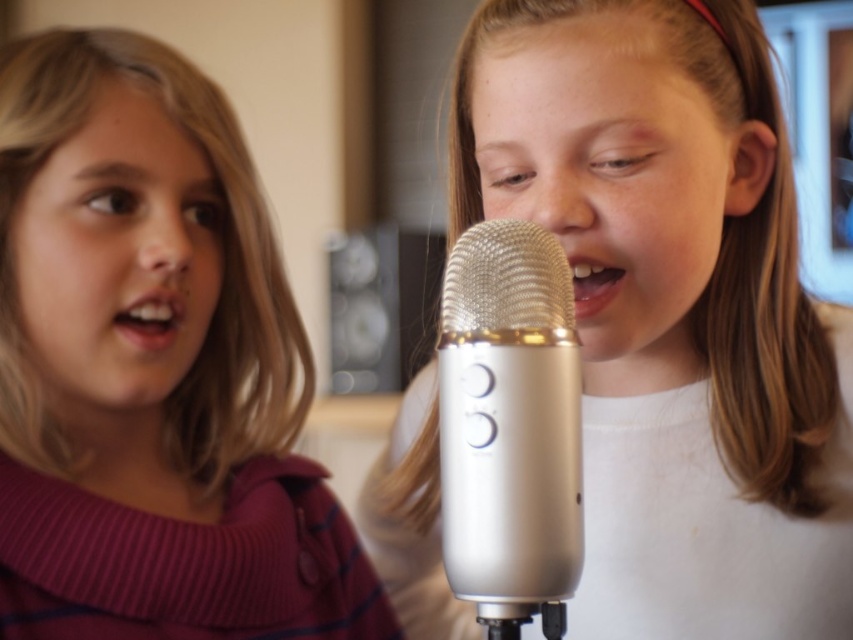
You are a photographer trying to capture the matte pink sweater at left. You have a camera with a focus point at coordinates (152, 368). Will this focus point be effective for capturing the matte pink sweater at left?

The point at coordinates (152, 368) indicates the location of the matte pink sweater at left, so yes, the focus point at (152, 368) will effectively capture the matte pink sweater at left.

You are a photographer trying to capture a closeup of the girl singing into the silver microphone with a mesh grille. You want to ensure that both points, point [718,605] and point [265,595], are in focus. Given that your camera can only focus on one point at a time, which point should you choose to ensure the girl and the microphone are sharp?

You should focus on point [718,605] because it is in front of point [265,595], meaning it is closer to the camera. Focusing on the closer point will ensure the girl and the microphone are sharp.